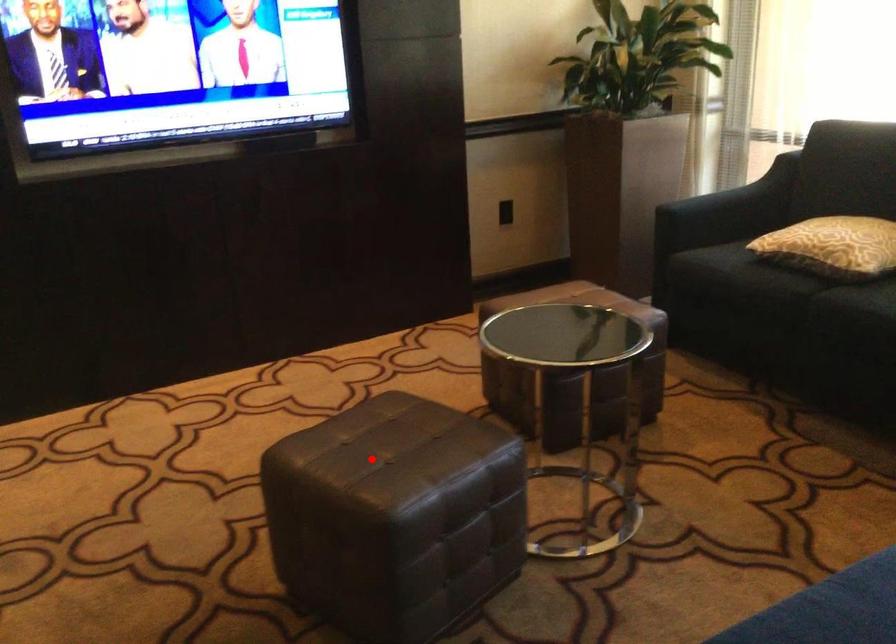
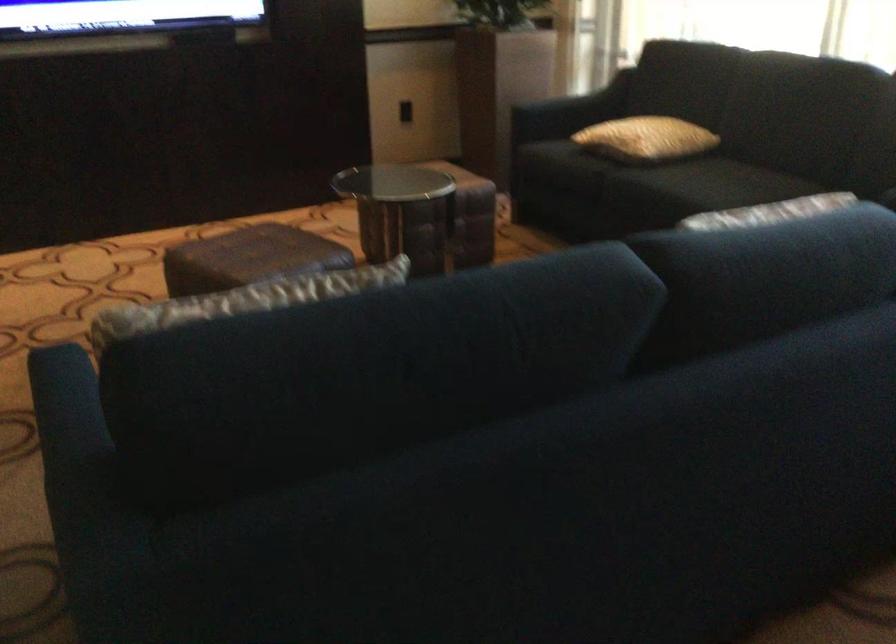
The point at the highlighted location is marked in the first image. Where is the corresponding point in the second image?

(248, 258)